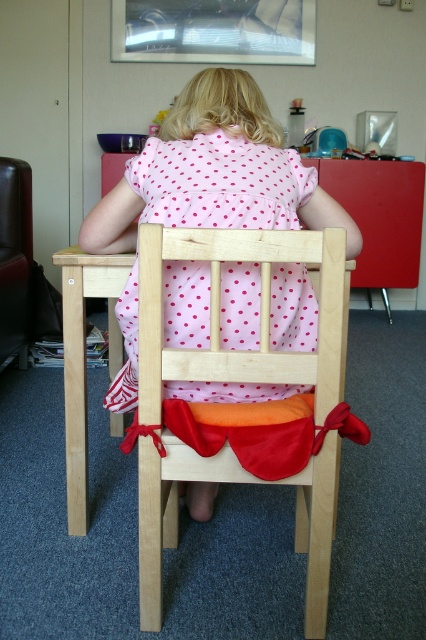
Question: In this image, where is pink polka dot dress at center located relative to wooden chair at center?

Choices:
 (A) below
 (B) above

Answer: (B)

Question: Among these points, which one is nearest to the camera?

Choices:
 (A) (135, 188)
 (B) (11, 312)
 (C) (215, 269)
 (D) (187, 182)

Answer: (C)

Question: Can you confirm if pink polka dot dress at center is thinner than wooden chair at center?

Choices:
 (A) no
 (B) yes

Answer: (A)

Question: Based on their relative distances, which object is nearer to the wooden chair at center?

Choices:
 (A) leather couch at left
 (B) pink polka dot dress at center
 (C) pink dotted fabric dress at center

Answer: (C)

Question: Among these points, which one is farthest from the camera?

Choices:
 (A) (244, 326)
 (B) (236, 330)
 (C) (167, 444)
 (D) (17, 291)

Answer: (D)

Question: Can you confirm if wooden chair at center is positioned above pink dotted fabric dress at center?

Choices:
 (A) no
 (B) yes

Answer: (A)